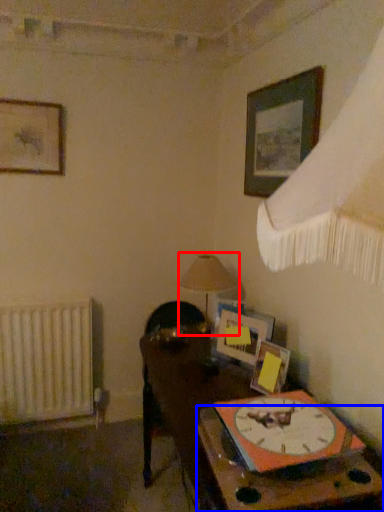
Question: Which of the following is the farthest to the observer, table lamp (highlighted by a red box) or table (highlighted by a blue box)?

Choices:
 (A) table lamp
 (B) table

Answer: (A)